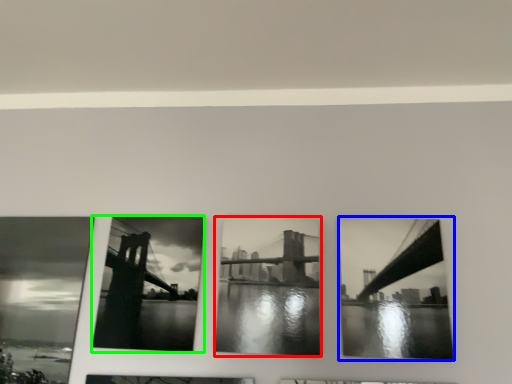
Question: Which is nearer to the picture frame (highlighted by a red box)? picture frame (highlighted by a blue box) or picture frame (highlighted by a green box).

Choices:
 (A) picture frame
 (B) picture frame

Answer: (B)